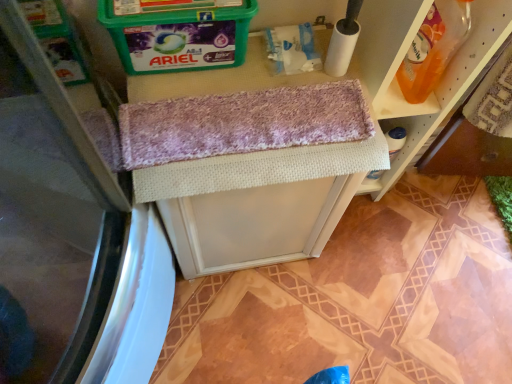
Describe the element at coordinates (257, 202) in the screenshot. The image size is (512, 384). I see `woven fabric vanity at center` at that location.

Find the location of a particular element. The height and width of the screenshot is (384, 512). woven fabric vanity at center is located at coordinates (257, 202).

What do you see at coordinates (433, 48) in the screenshot?
I see `translucent orange bottle at upper right` at bounding box center [433, 48].

What are the coordinates of `translucent orange bottle at upper right` in the screenshot? It's located at [x=433, y=48].

I want to click on woven fabric vanity at center, so click(x=257, y=202).

Looking at this image, considering the positions of objects translucent orange bottle at upper right and woven fabric vanity at center in the image provided, who is more to the left, translucent orange bottle at upper right or woven fabric vanity at center?

From the viewer's perspective, woven fabric vanity at center appears more on the left side.

Which object is further away from the camera taking this photo, translucent orange bottle at upper right or woven fabric vanity at center?

woven fabric vanity at center is behind.

Does point (459, 7) lie behind point (304, 220)?

That is False.

From the image's perspective, is translucent orange bottle at upper right on top of woven fabric vanity at center?

Yes, from the image's perspective, translucent orange bottle at upper right is over woven fabric vanity at center.

From a real-world perspective, between translucent orange bottle at upper right and woven fabric vanity at center, who is vertically lower?

In real-world perspective, woven fabric vanity at center is lower.

Considering the relative sizes of translucent orange bottle at upper right and woven fabric vanity at center in the image provided, is translucent orange bottle at upper right thinner than woven fabric vanity at center?

Correct, the width of translucent orange bottle at upper right is less than that of woven fabric vanity at center.

Can you confirm if translucent orange bottle at upper right is shorter than woven fabric vanity at center?

Yes.

Can you confirm if translucent orange bottle at upper right is smaller than woven fabric vanity at center?

Yes.

Would you say woven fabric vanity at center is part of translucent orange bottle at upper right's contents?

Actually, woven fabric vanity at center is outside translucent orange bottle at upper right.

Would you consider translucent orange bottle at upper right to be distant from woven fabric vanity at center?

No.

Does translucent orange bottle at upper right turn towards woven fabric vanity at center?

No, translucent orange bottle at upper right does not turn towards woven fabric vanity at center.

Locate an element on the screen. cleaning product above the woven fabric vanity at center (from a real-world perspective) is located at coordinates (433, 48).

Consider the image. Considering the relative positions of woven fabric vanity at center and translucent orange bottle at upper right in the image provided, is woven fabric vanity at center to the left or to the right of translucent orange bottle at upper right?

Clearly, woven fabric vanity at center is on the left of translucent orange bottle at upper right in the image.

Considering the positions of objects woven fabric vanity at center and translucent orange bottle at upper right in the image provided, who is behind, woven fabric vanity at center or translucent orange bottle at upper right?

woven fabric vanity at center is more distant.

Which is further, (233,215) or (408,68)?

The point (408,68) is behind.

From the image's perspective, which one is positioned higher, woven fabric vanity at center or translucent orange bottle at upper right?

translucent orange bottle at upper right, from the image's perspective.

From a real-world perspective, does woven fabric vanity at center sit lower than translucent orange bottle at upper right?

Yes, from a real-world perspective, woven fabric vanity at center is under translucent orange bottle at upper right.

Is woven fabric vanity at center wider or thinner than translucent orange bottle at upper right?

In the image, woven fabric vanity at center appears to be wider than translucent orange bottle at upper right.

Considering the sizes of objects woven fabric vanity at center and translucent orange bottle at upper right in the image provided, who is taller, woven fabric vanity at center or translucent orange bottle at upper right?

woven fabric vanity at center.

Between woven fabric vanity at center and translucent orange bottle at upper right, which one has larger size?

Bigger between the two is woven fabric vanity at center.

Does woven fabric vanity at center contain translucent orange bottle at upper right?

No.

Is there a large distance between woven fabric vanity at center and translucent orange bottle at upper right?

No.

Is woven fabric vanity at center aimed at translucent orange bottle at upper right?

No, woven fabric vanity at center is not turned towards translucent orange bottle at upper right.

How many degrees apart are the facing directions of woven fabric vanity at center and translucent orange bottle at upper right?

3.27 degrees.

Locate an element on the screen. The height and width of the screenshot is (384, 512). cleaning product to the right of woven fabric vanity at center is located at coordinates (433, 48).

Where is `vanity that is below the translucent orange bottle at upper right (from the image's perspective)`? The image size is (512, 384). vanity that is below the translucent orange bottle at upper right (from the image's perspective) is located at coordinates (257, 202).

Find the location of a particular element. cleaning product lying on the right of woven fabric vanity at center is located at coordinates (433, 48).